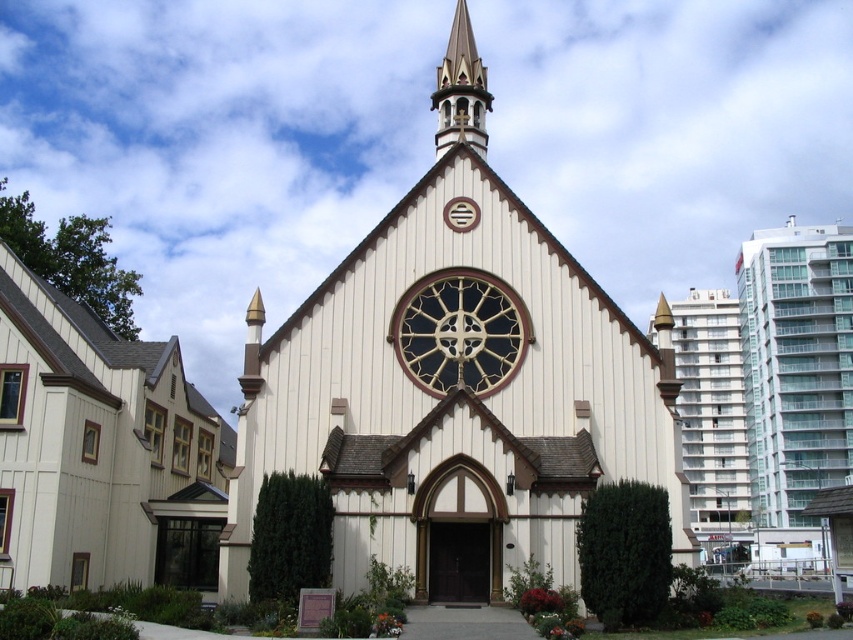
You are standing in front of the church and want to touch either the white wood siding at left or the polished wood spire at upper center. Which one can you reach without climbing?

The white wood siding at left is closer to the viewer than the polished wood spire at upper center, so you can reach the white wood siding at left without climbing.

You are standing in front of the church and want to take a photo that includes both the central stained glass window and the white glass building at right. Based on their positions, where should you position yourself to ensure both are in frame?

To capture both the central stained glass window and the white glass building at right in your photo, position yourself centrally in front of the church. The white glass building at right is located at coordinates approximately 0.647 on the x and 0.832 on the y axis, which means it is positioned to the right side and slightly above the center of the image. By centering the camera on the church, you can ensure both elements are within the frame.

You are an architect analyzing the church facade. Which object takes up more visual space on the facade between the white wood siding at left and the polished wood spire at upper center?

The polished wood spire at upper center occupies more visual space than the white wood siding at left according to the description.